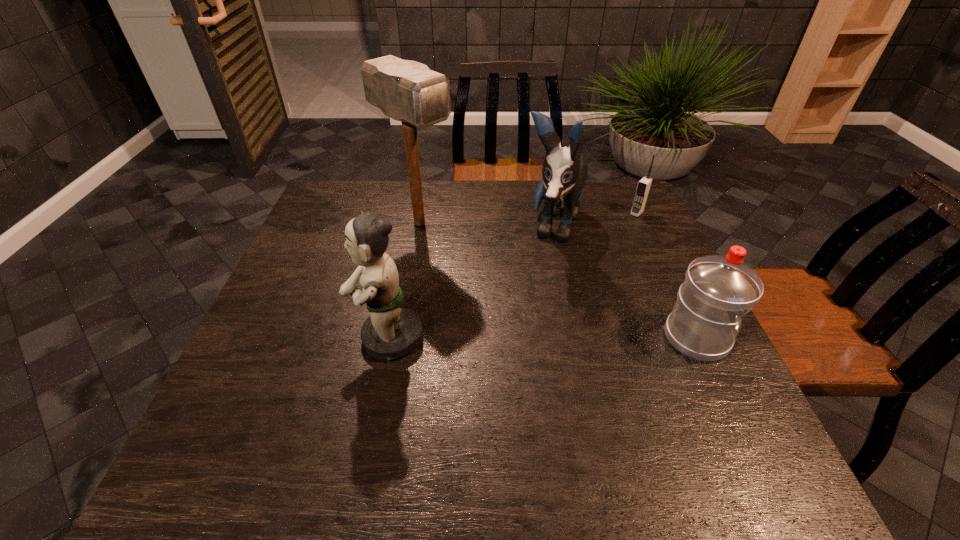
I want to click on figurine, so click(391, 331).

This screenshot has height=540, width=960. What are the coordinates of `water bottle` in the screenshot? It's located at (718, 290).

Find the location of `the third object from right to left`. the third object from right to left is located at coordinates (564, 173).

You are a GUI agent. You are given a task and a screenshot of the screen. Output one action in this format:
    pyautogui.click(x=<x>, y=<y>)
    Task: Click on the puppy
    This screenshot has width=960, height=540.
    Given the screenshot: What is the action you would take?
    (x=564, y=173)

You are a GUI agent. You are given a task and a screenshot of the screen. Output one action in this format:
    pyautogui.click(x=<x>, y=<y>)
    Task: Click on the cellular telephone
    The width and height of the screenshot is (960, 540).
    Given the screenshot: What is the action you would take?
    pyautogui.click(x=643, y=188)

What are the coordinates of `mallet` in the screenshot? It's located at (408, 91).

This screenshot has width=960, height=540. Find the location of `free space located on the front-facing side of the figurine`. free space located on the front-facing side of the figurine is located at coordinates (253, 338).

Where is `vacant space located 0.090m on the front-facing side of the figurine`? vacant space located 0.090m on the front-facing side of the figurine is located at coordinates (312, 338).

I want to click on vacant space located 0.200m on the front-facing side of the figurine, so click(263, 338).

Identify the location of vacant space located on the front-facing side of the puppy. pyautogui.click(x=512, y=346).